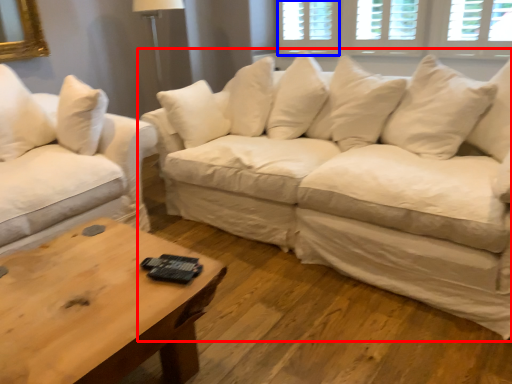
Question: Which point is further to the camera, studio couch (highlighted by a red box) or window (highlighted by a blue box)?

Choices:
 (A) studio couch
 (B) window

Answer: (B)